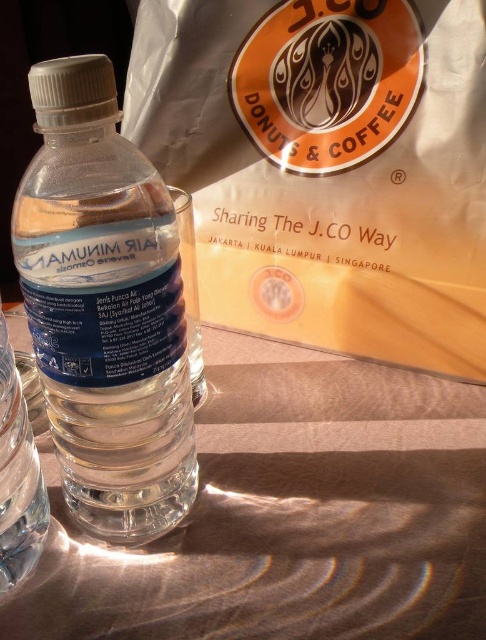
You are a delivery person who needs to pick up an item from a location marked by the point coordinates. The scene shows a clear plastic bottle of water at the center and a white paper bag with a logo. Which object is located at the coordinates point (292,515)?

The point (292,515) corresponds to the translucent plastic water at center.

user is a delivery person who needs to pack items into a box. The box has limited space. The user sees the translucent plastic water at center and the clear plastic bottle at center. Which item should be placed first into the box to optimize space?

The translucent plastic water at center is below clear plastic bottle at center, so placing the clear plastic bottle at center first would allow the translucent plastic water at center to be placed underneath it, optimizing space usage.

What is the exact 2D coordinate of the translucent plastic water at center?

The exact 2D coordinate of the translucent plastic water at center is at point (292, 515).